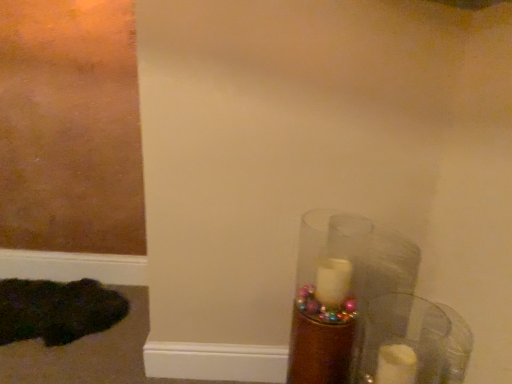
Question: Is transparent glass candle at right bigger than translucent glass candle at lower right?

Choices:
 (A) yes
 (B) no

Answer: (B)

Question: Is transparent glass candle at right outside of translucent glass candle at lower right?

Choices:
 (A) yes
 (B) no

Answer: (A)

Question: Is transparent glass candle at right positioned far away from translucent glass candle at lower right?

Choices:
 (A) no
 (B) yes

Answer: (A)

Question: Does transparent glass candle at right contain translucent glass candle at lower right?

Choices:
 (A) no
 (B) yes

Answer: (A)

Question: From a real-world perspective, is transparent glass candle at right over translucent glass candle at lower right?

Choices:
 (A) no
 (B) yes

Answer: (B)

Question: Does transparent glass candle at right have a smaller size compared to translucent glass candle at lower right?

Choices:
 (A) yes
 (B) no

Answer: (A)

Question: Is dark green fur at lower left inside translucent glass candle at lower right?

Choices:
 (A) yes
 (B) no

Answer: (B)

Question: Is the position of translucent glass candle at lower right less distant than that of dark green fur at lower left?

Choices:
 (A) no
 (B) yes

Answer: (B)

Question: Considering the relative sizes of translucent glass candle at lower right and dark green fur at lower left in the image provided, is translucent glass candle at lower right wider than dark green fur at lower left?

Choices:
 (A) no
 (B) yes

Answer: (A)

Question: Is translucent glass candle at lower right to the right of dark green fur at lower left from the viewer's perspective?

Choices:
 (A) no
 (B) yes

Answer: (B)

Question: From the image's perspective, is translucent glass candle at lower right beneath dark green fur at lower left?

Choices:
 (A) no
 (B) yes

Answer: (A)

Question: Is translucent glass candle at lower right oriented towards dark green fur at lower left?

Choices:
 (A) yes
 (B) no

Answer: (B)

Question: Is dark green fur at lower left in contact with translucent glass candle at lower right?

Choices:
 (A) no
 (B) yes

Answer: (A)